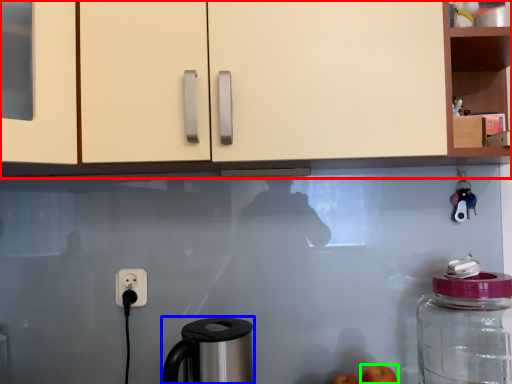
Question: Considering the real-world distances, which object is farthest from cabinetry (highlighted by a red box)? coffee maker (highlighted by a blue box) or apple (highlighted by a green box)?

Choices:
 (A) coffee maker
 (B) apple

Answer: (B)